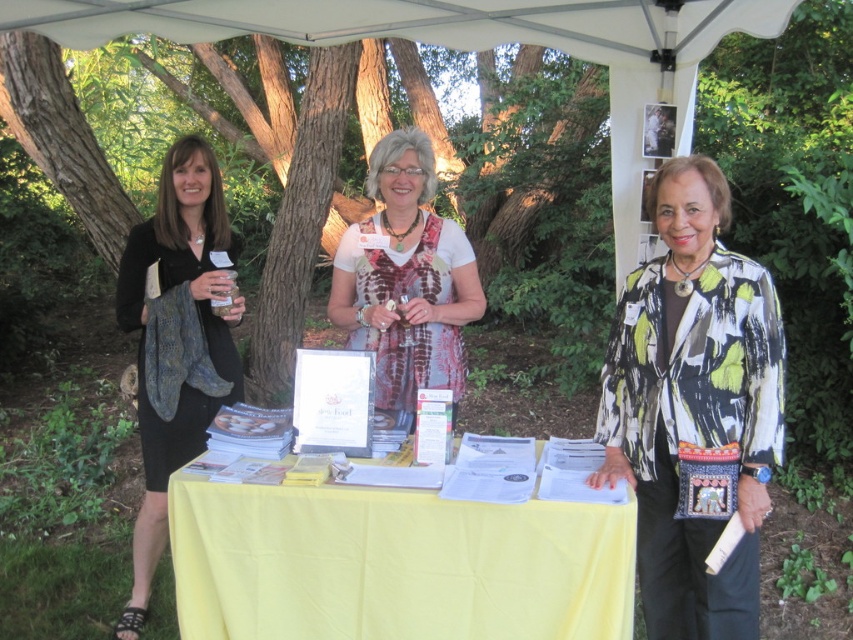
You are organizing a community event and need to display two scarves on a table. The black matte scarf at left and the white printed scarf at center must be arranged so that the wider scarf is placed on the left side of the table. Which scarf should you place on the left?

The black matte scarf at left should be placed on the left side of the table because it is wider than the white printed scarf at center.

Looking at this image, you are a visitor at this outdoor event and want to approach the yellow fabric table at center to pick up some brochures. If you are currently standing 6.02 feet away from the table, how many steps do you need to take to reach it?

Since you are 6.02 feet away from the yellow fabric table at center, and assuming an average step length of about 2.5 feet, you would need approximately 2 to 3 steps to reach the table.